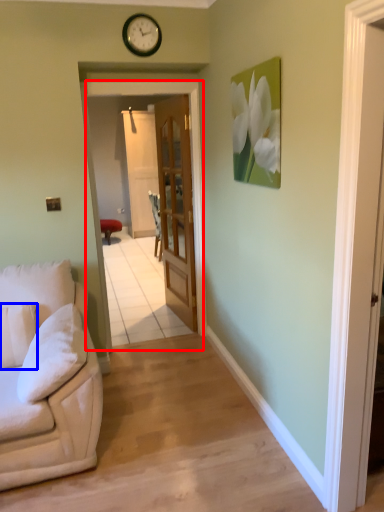
Question: Among these objects, which one is farthest to the camera, screen door (highlighted by a red box) or pillow (highlighted by a blue box)?

Choices:
 (A) screen door
 (B) pillow

Answer: (A)